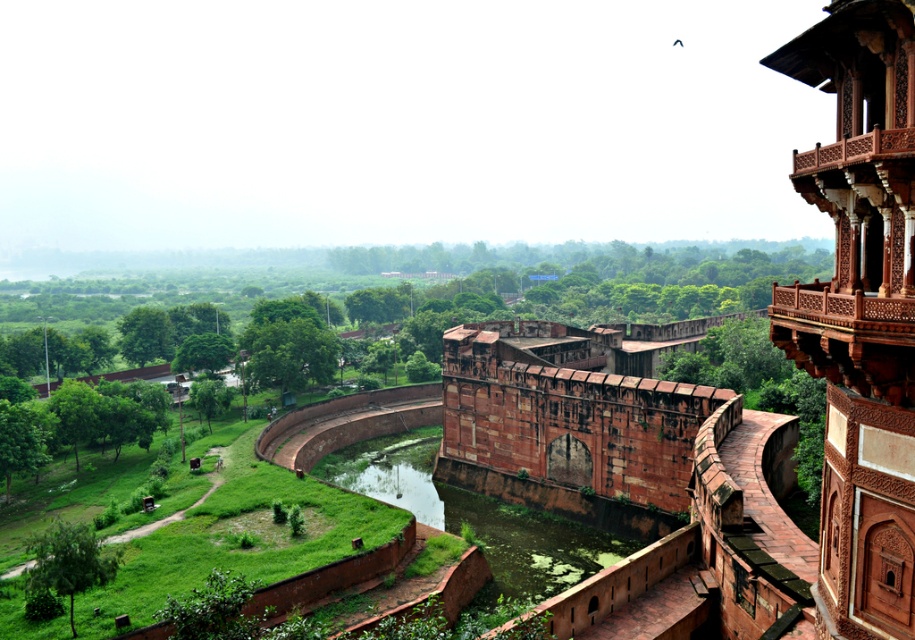
You are standing at the point with coordinates (574,406) in the image. What structure are you in front of?

The point at (574,406) corresponds to the rustic stone fortress at center, so you are in front of the rustic stone fortress at center.